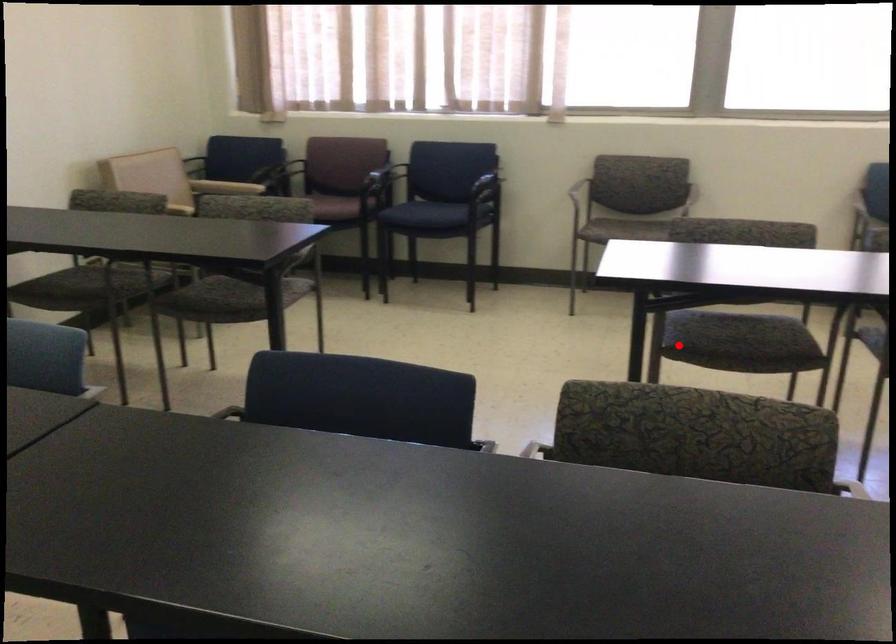
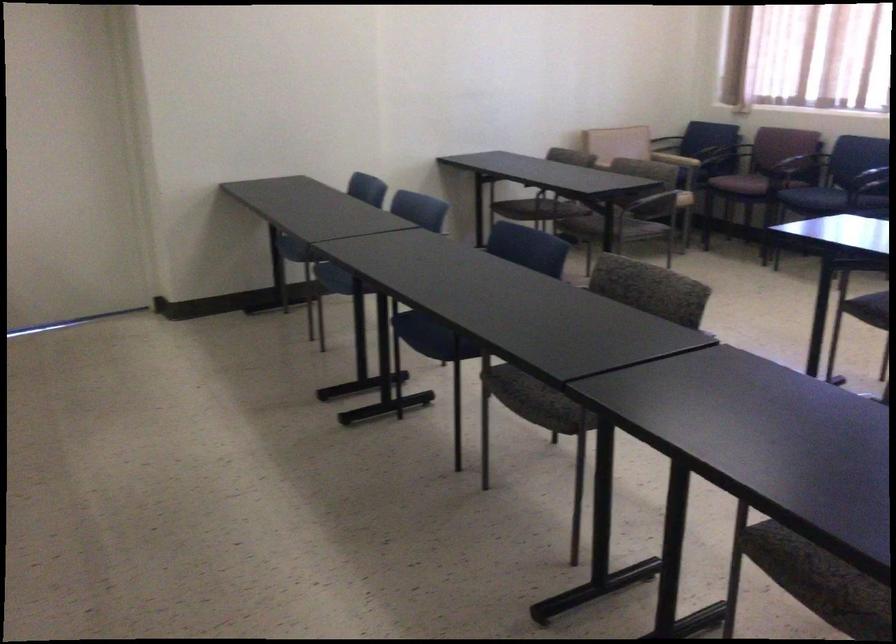
In the second image, find the point that corresponds to the highlighted location in the first image.

(868, 308)